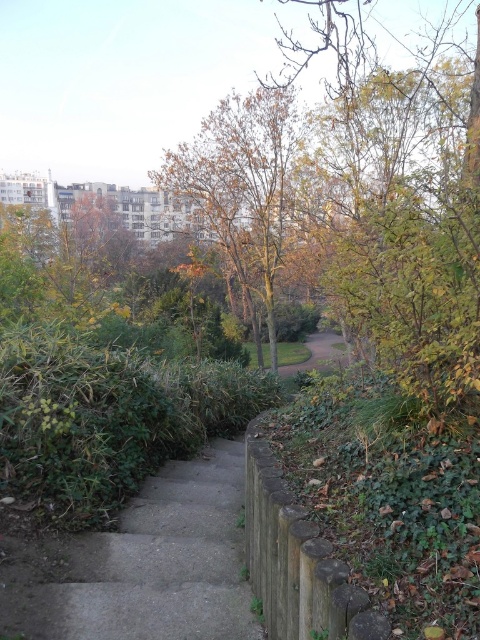
Between green leafy tree at upper center and green grass at center, which one has less height?

green grass at center is shorter.

How far apart are green leafy tree at upper center and green grass at center?

They are 9.77 meters apart.

This screenshot has width=480, height=640. I want to click on green leafy tree at upper center, so click(x=404, y=212).

Who is positioned more to the right, concrete stairs at center or brown leafy tree at center?

brown leafy tree at center is more to the right.

Does concrete stairs at center have a lesser height compared to brown leafy tree at center?

Correct, concrete stairs at center is not as tall as brown leafy tree at center.

Where is `concrete stairs at center`? The image size is (480, 640). concrete stairs at center is located at coordinates (147, 564).

The image size is (480, 640). What are the coordinates of `concrete stairs at center` in the screenshot? It's located at (147, 564).

Who is more distant from viewer, (305, 60) or (203, 234)?

Point (305, 60)

Which is above, green leafy tree at upper center or brown leafy tree at center?

Positioned higher is green leafy tree at upper center.

Where is `green leafy tree at upper center`? This screenshot has width=480, height=640. green leafy tree at upper center is located at coordinates (404, 212).